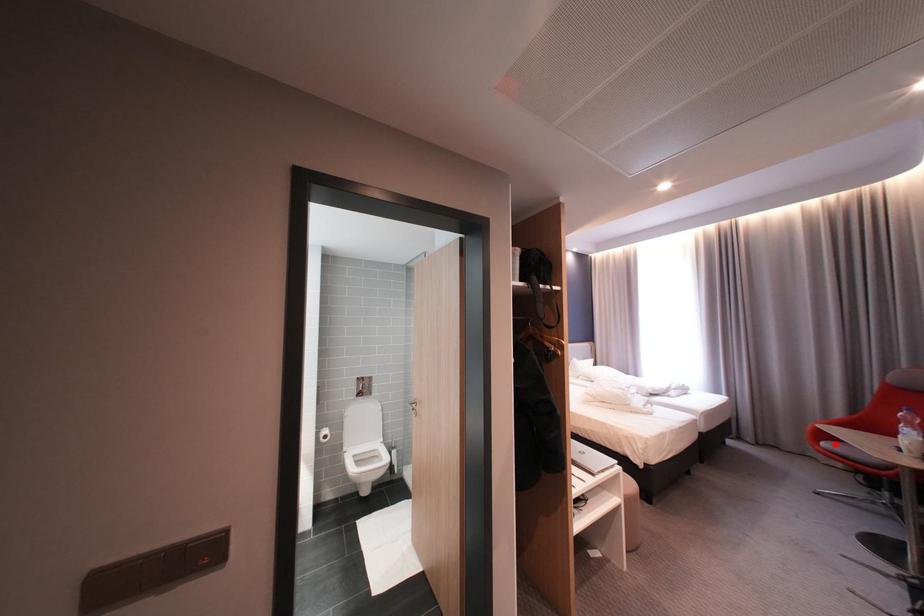
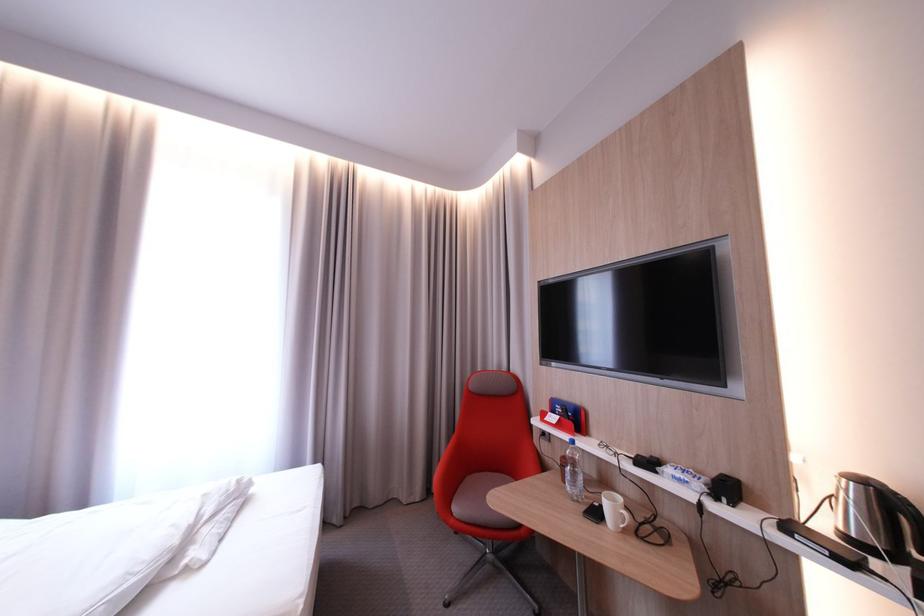
Question: A red point is marked in image1. In image2, is the corresponding 3D point closer to the camera or farther? Reply with the corresponding letter.

Choices:
 (A) The corresponding 3D point is closer.
 (B) The corresponding 3D point is farther.

Answer: (A)